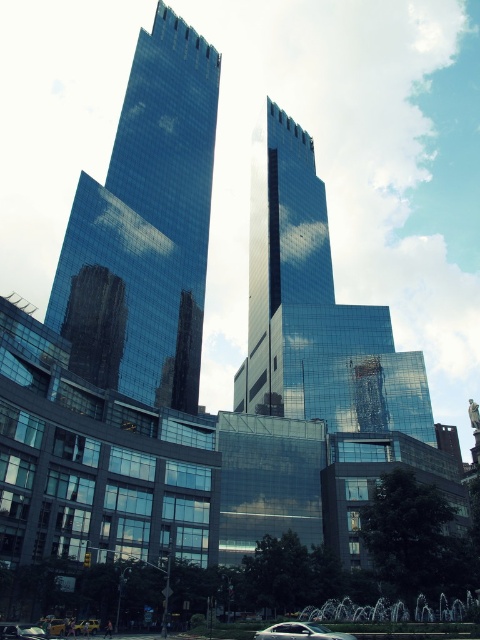
Between glossy glass tower at left and shiny glass skyscraper at center, which one is positioned lower?

Positioned lower is shiny glass skyscraper at center.

Which is behind, point (132, 140) or point (339, 371)?

Positioned behind is point (132, 140).

Locate an element on the screen. The height and width of the screenshot is (640, 480). glossy glass tower at left is located at coordinates (145, 227).

Identify the location of glossy glass tower at left. (145, 227).

Does glossy glass tower at left have a larger size compared to sleek silver sedan at lower center?

Yes, glossy glass tower at left is bigger than sleek silver sedan at lower center.

Is glossy glass tower at left smaller than sleek silver sedan at lower center?

No.

Does point (137, 52) lie behind point (343, 634)?

Yes, it is behind point (343, 634).

Locate an element on the screen. glossy glass tower at left is located at coordinates (145, 227).

Does point (328, 390) lie in front of point (343, 637)?

That is False.

Does shiny glass skyscraper at center have a greater width compared to sleek silver sedan at lower center?

Yes, shiny glass skyscraper at center is wider than sleek silver sedan at lower center.

Identify the location of shiny glass skyscraper at center. The height and width of the screenshot is (640, 480). (313, 308).